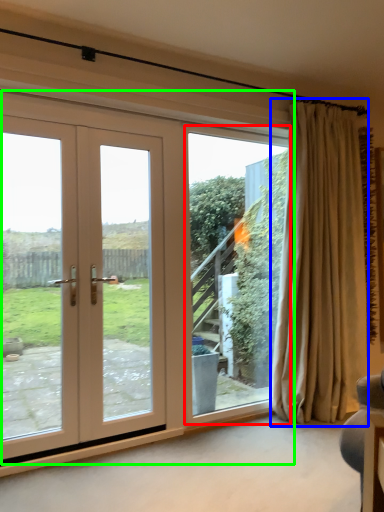
Question: Which object is positioned closest to window screen (highlighted by a red box)? Select from curtain (highlighted by a blue box) and door (highlighted by a green box).

Choices:
 (A) curtain
 (B) door

Answer: (A)